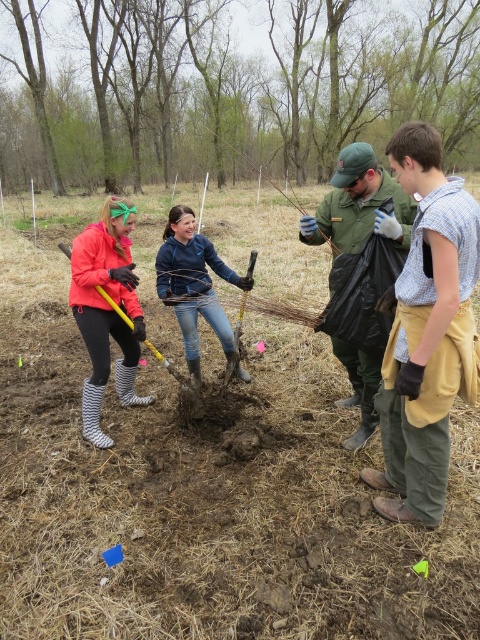
Question: Estimate the real-world distances between objects in this image. Which object is farther from the blue denim jeans at center?

Choices:
 (A) light blue plaid shirt at center
 (B) green matte jacket at center
 (C) matte pink jacket at left
 (D) yellow metal shovel at center

Answer: (A)

Question: Estimate the real-world distances between objects in this image. Which object is closer to the yellow plastic shovel at lower left?

Choices:
 (A) blue denim jeans at center
 (B) light blue plaid shirt at center
 (C) smooth bark tree at upper center
 (D) matte pink jacket at left

Answer: (D)

Question: Which point is farther to the camera?

Choices:
 (A) light blue plaid shirt at center
 (B) smooth bark tree at upper center

Answer: (B)

Question: Does matte pink jacket at left have a larger size compared to green matte jacket at center?

Choices:
 (A) no
 (B) yes

Answer: (A)

Question: Observing the image, what is the correct spatial positioning of matte pink jacket at left in reference to green matte jacket at center?

Choices:
 (A) left
 (B) right

Answer: (A)

Question: Is light blue plaid shirt at center closer to the viewer compared to green matte jacket at center?

Choices:
 (A) yes
 (B) no

Answer: (A)